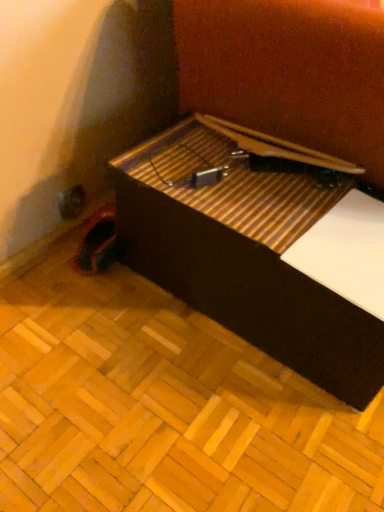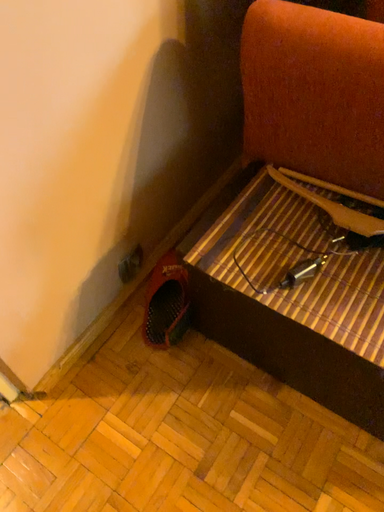
Question: How did the camera likely rotate when shooting the video?

Choices:
 (A) rotated downward
 (B) rotated upward

Answer: (A)